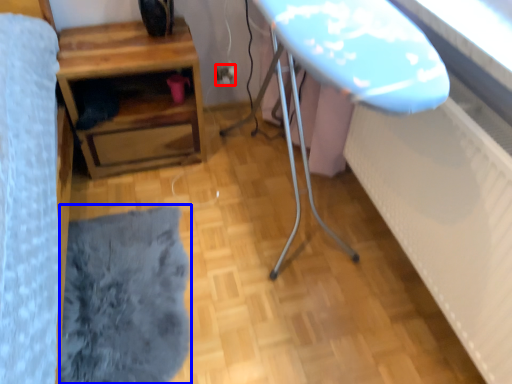
Question: Which object is further to the camera taking this photo, electric outlet (highlighted by a red box) or flat (highlighted by a blue box)?

Choices:
 (A) electric outlet
 (B) flat

Answer: (A)